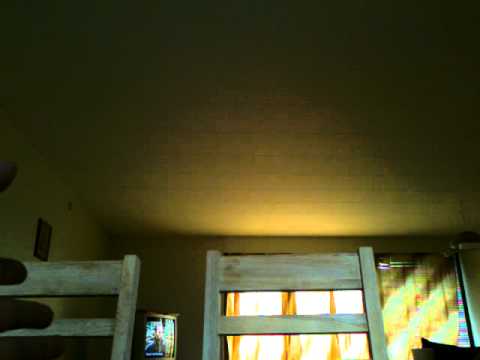
I want to click on edge of chair, so click(72, 260), click(284, 255).